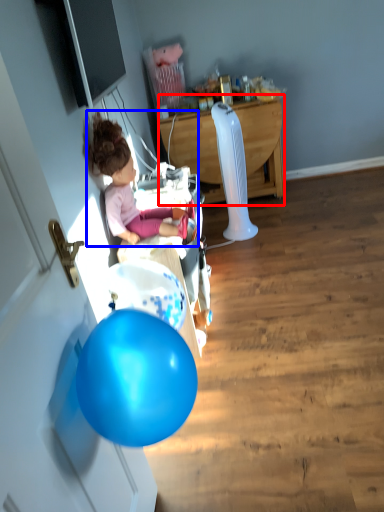
Question: Which object is further to the camera taking this photo, desk (highlighted by a red box) or person (highlighted by a blue box)?

Choices:
 (A) desk
 (B) person

Answer: (A)